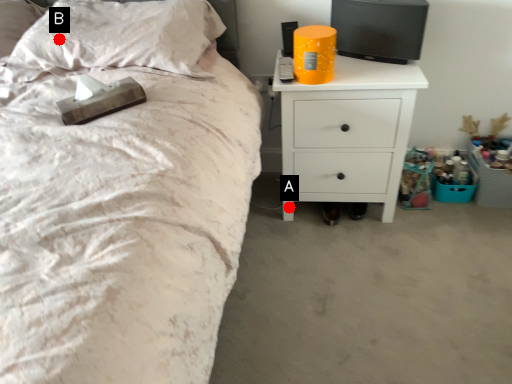
Question: Two points are circled on the image, labeled by A and B beside each circle. Among these points, which one is farthest from the camera?

Choices:
 (A) A is further
 (B) B is further

Answer: (A)